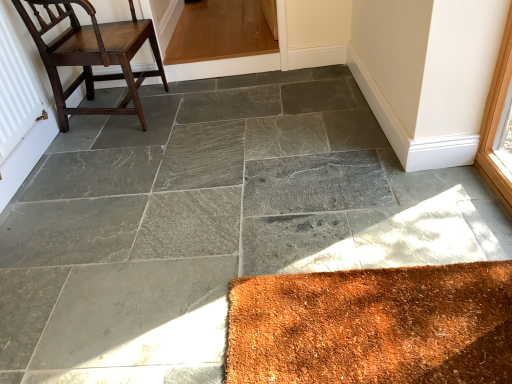
The image size is (512, 384). Find the location of `vacant area situated below dark brown wood chair at left (from a real-world perspective)`. vacant area situated below dark brown wood chair at left (from a real-world perspective) is located at coordinates (115, 114).